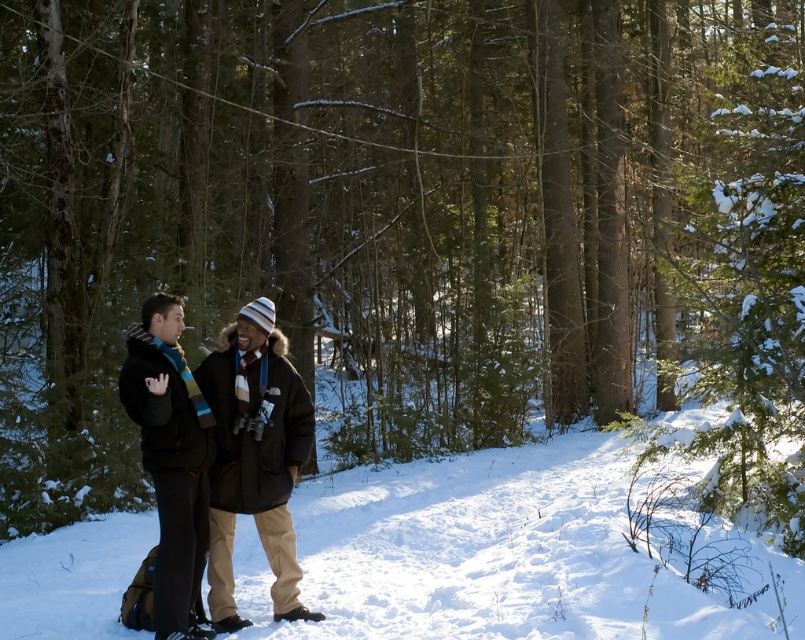
Can you confirm if dark brown wool coat at center is thinner than knitted wool scarf at left?

Incorrect, dark brown wool coat at center's width is not less than knitted wool scarf at left's.

Is point (259, 400) closer to viewer compared to point (180, 416)?

No, (259, 400) is further to viewer.

Find the location of a particular element. The image size is (805, 640). dark brown wool coat at center is located at coordinates (226, 436).